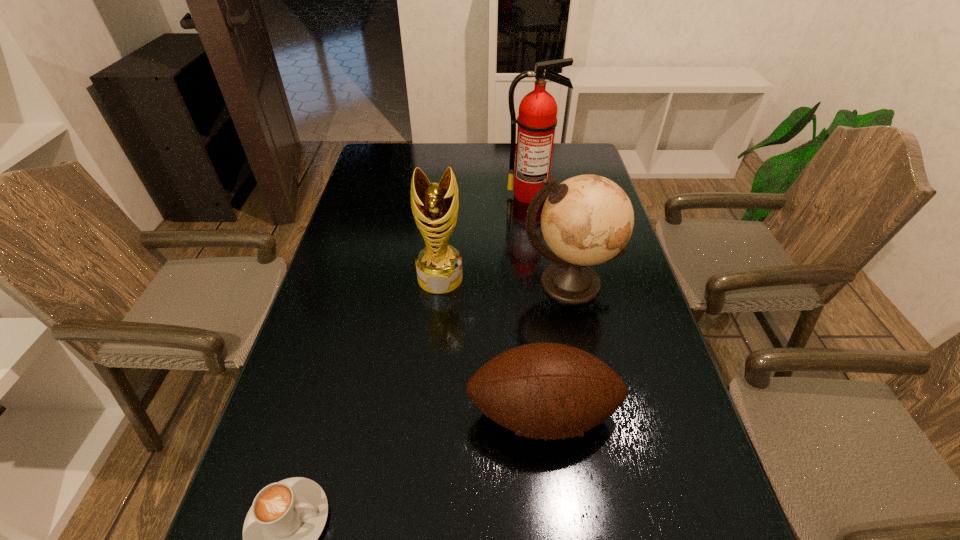
The width and height of the screenshot is (960, 540). In order to click on vacant area that lies between the globe and the award in this screenshot , I will do `click(504, 280)`.

Identify the location of vacant point located between the second shortest object and the second object from left to right. This screenshot has width=960, height=540. (492, 346).

Identify which object is the nearest to the award. Please provide its 2D coordinates. Your answer should be formatted as a tuple, i.e. [(x, y)], where the tuple contains the x and y coordinates of a point satisfying the conditions above.

[(587, 220)]

At what (x,y) coordinates should I click in order to perform the action: click on object that is the closest to the fourth tallest object. Please return your answer as a coordinate pair (x, y). The image size is (960, 540). Looking at the image, I should click on (587, 220).